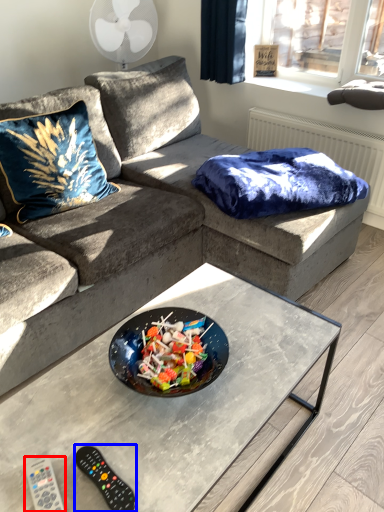
Question: Which object appears farthest to the camera in this image, remote (highlighted by a red box) or remote (highlighted by a blue box)?

Choices:
 (A) remote
 (B) remote

Answer: (B)